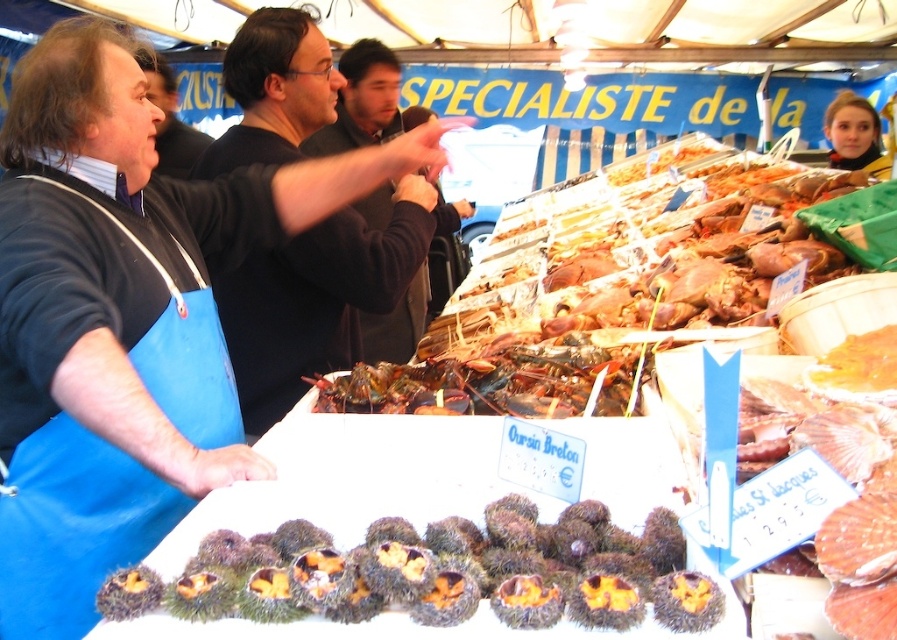
Who is positioned more to the right, black sweater at center or matte black apron at upper left?

Positioned to the right is black sweater at center.

Find the location of `black sweater at center`. black sweater at center is located at coordinates (315, 300).

Who is positioned more to the left, black sweater at center or dark brown sweater at center?

dark brown sweater at center is more to the left.

Does black sweater at center have a larger size compared to dark brown sweater at center?

Indeed, black sweater at center has a larger size compared to dark brown sweater at center.

Which is behind, point (259, 429) or point (390, 349)?

The point (390, 349) is behind.

Identify the location of black sweater at center. (315, 300).

Which is below, brown fuzzy sea urchins at center or matte black apron at upper left?

Positioned lower is brown fuzzy sea urchins at center.

Is point (514, 576) positioned after point (170, 164)?

No, (514, 576) is closer to viewer.

Locate an element on the screen. brown fuzzy sea urchins at center is located at coordinates (425, 579).